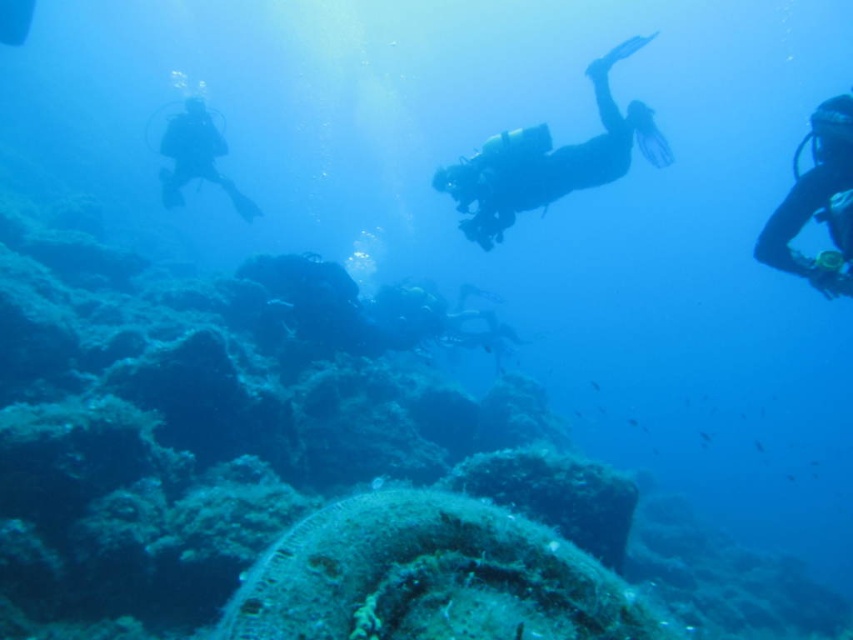
Who is lower down, black matte scuba diver at center or black matte scuba diver at right?

black matte scuba diver at right

Does black matte scuba diver at center come behind black matte scuba diver at right?

Yes, black matte scuba diver at center is further from the viewer.

Which is in front, point (643, 124) or point (805, 192)?

Point (805, 192) is more forward.

The width and height of the screenshot is (853, 640). Identify the location of black matte scuba diver at center. coord(549,161).

Does point (827, 189) lie behind point (201, 132)?

No.

Consider the image. Does black matte scuba diver at right have a smaller size compared to silhouette diving gear at left?

Actually, black matte scuba diver at right might be larger than silhouette diving gear at left.

In the scene shown: Who is more forward, [804,189] or [170,129]?

Point [804,189] is in front.

What are the coordinates of `black matte scuba diver at right` in the screenshot? It's located at (817, 202).

Does black matte scuba diver at center lie behind silhouette diving gear at left?

No, black matte scuba diver at center is closer to the viewer.

Can you confirm if black matte scuba diver at center is positioned below silhouette diving gear at left?

Correct, black matte scuba diver at center is located below silhouette diving gear at left.

This screenshot has width=853, height=640. What are the coordinates of `black matte scuba diver at center` in the screenshot? It's located at (549, 161).